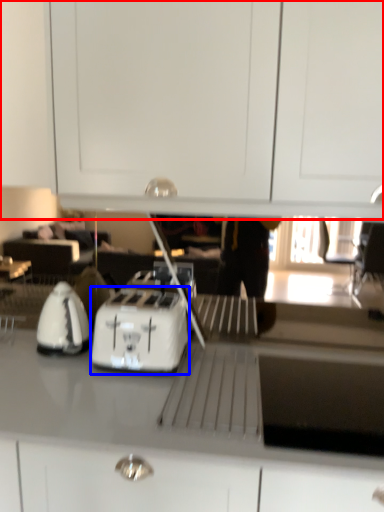
Question: Which of the following is the farthest to the observer, dresser (highlighted by a red box) or kitchen appliance (highlighted by a blue box)?

Choices:
 (A) dresser
 (B) kitchen appliance

Answer: (B)